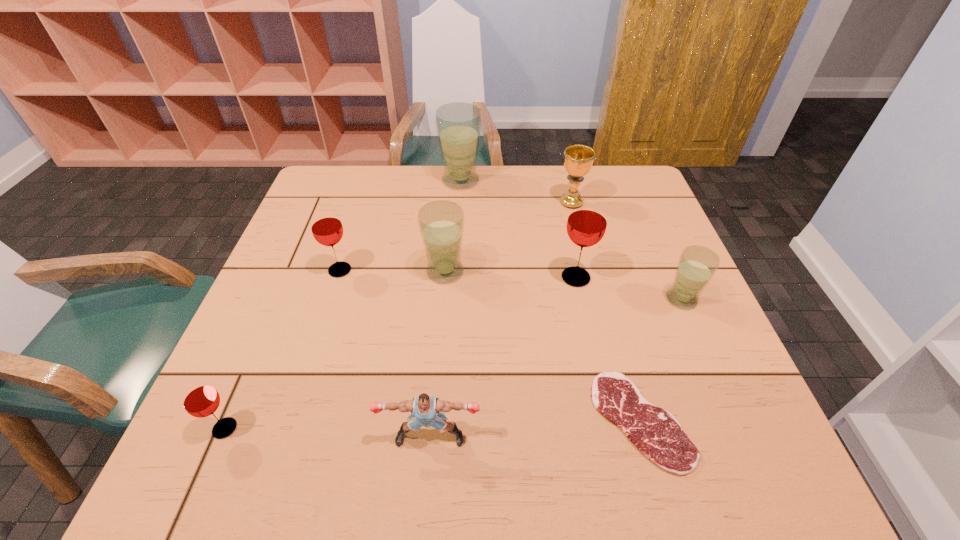
Where is `the fifth glass from left to right`? the fifth glass from left to right is located at coordinates (587, 221).

Locate an element on the screen. The width and height of the screenshot is (960, 540). the rightmost red glass is located at coordinates (587, 221).

At what (x,y) coordinates should I click in order to perform the action: click on the farthest glass. Please return your answer as a coordinate pair (x, y). This screenshot has height=540, width=960. Looking at the image, I should click on (458, 124).

The image size is (960, 540). Identify the location of the farthest blue glass. (458, 124).

Where is `the second biggest red glass`? the second biggest red glass is located at coordinates (327, 229).

The image size is (960, 540). What are the coordinates of `the second object from left to right` in the screenshot? It's located at (327, 229).

Identify the location of the second smallest blue glass. (441, 223).

You are a GUI agent. You are given a task and a screenshot of the screen. Output one action in this format:
    pyautogui.click(x=<x>, y=<y>)
    Task: Click on the eighth nearest object
    This screenshot has width=960, height=540.
    Given the screenshot: What is the action you would take?
    pyautogui.click(x=578, y=160)

Where is `chalice`? chalice is located at coordinates (578, 160).

This screenshot has width=960, height=540. I want to click on red puncher, so click(x=424, y=408).